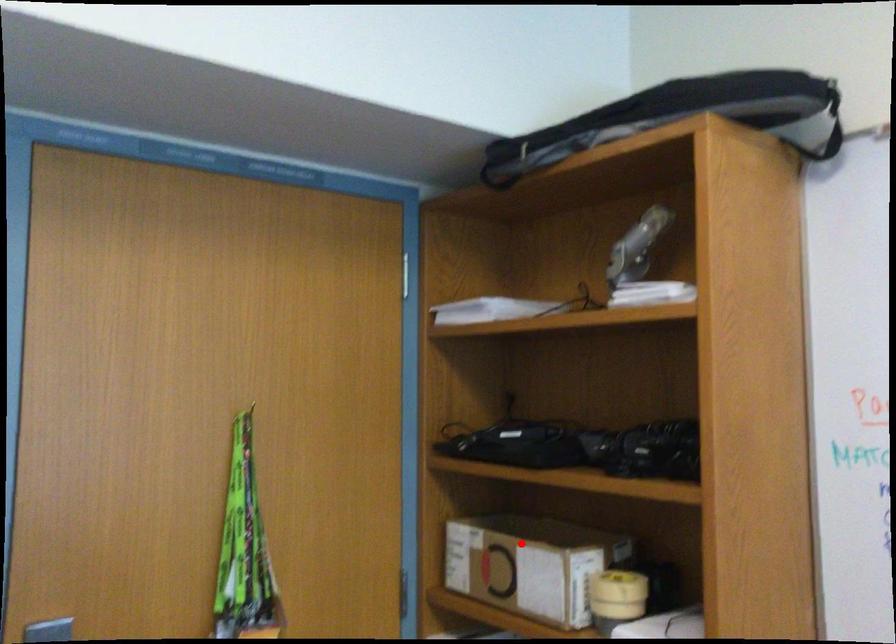
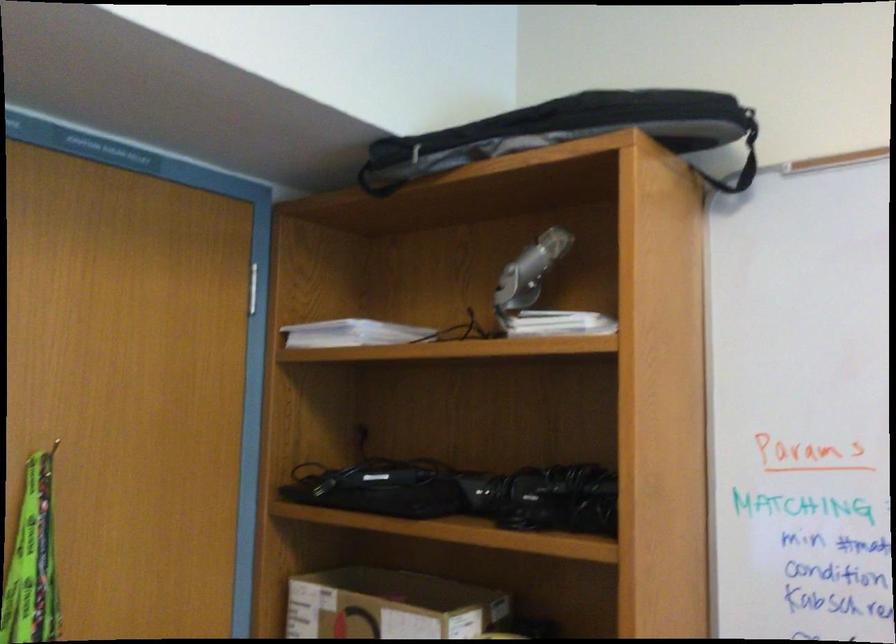
Question: I am providing you with two images of the same scene from different viewpoints. Given a red point in image1, look at the same physical point in image2. Is it:

Choices:
 (A) Closer to the viewpoint
 (B) Farther from the viewpoint

Answer: (A)